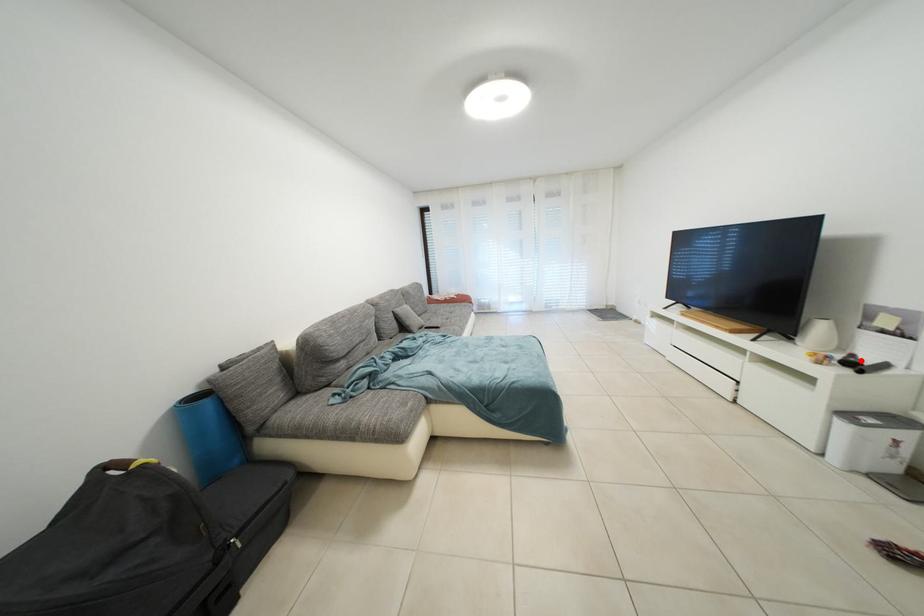
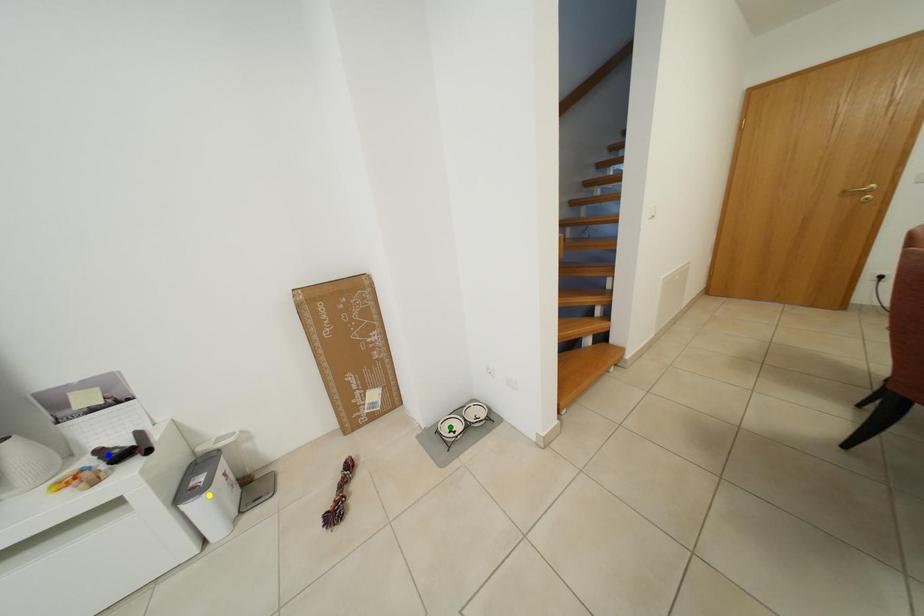
Question: I am providing you with two images of the same scene from different viewpoints. A red point is marked on the first image. You are given multiple points on the second image. Can you choose the point in image 2 that corresponds to the point in image 1?

Choices:
 (A) green point
 (B) blue point
 (C) yellow point

Answer: (B)